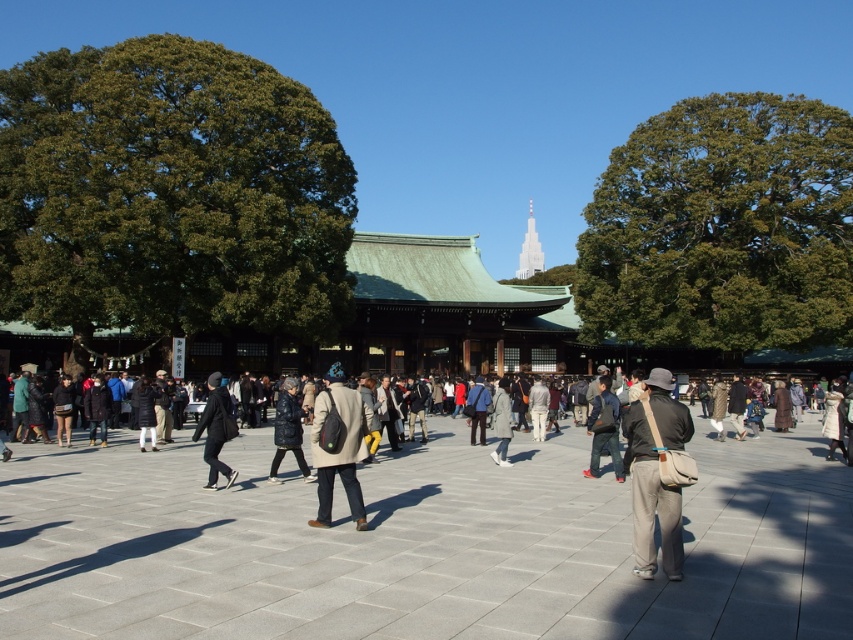
Does khaki canvas bag at center appear under dark gray fabric jacket at center?

Incorrect, khaki canvas bag at center is not positioned below dark gray fabric jacket at center.

Can you confirm if khaki canvas bag at center is bigger than dark gray fabric jacket at center?

No, khaki canvas bag at center is not bigger than dark gray fabric jacket at center.

Is point (650, 378) more distant than point (233, 424)?

No, (650, 378) is in front of (233, 424).

Locate an element on the screen. Image resolution: width=853 pixels, height=640 pixels. khaki canvas bag at center is located at coordinates (651, 500).

From the picture: Who is taller, matte black backpack at center or dark gray fabric jacket at center?

dark gray fabric jacket at center

Can you confirm if matte black backpack at center is bigger than dark gray fabric jacket at center?

No.

Locate an element on the screen. Image resolution: width=853 pixels, height=640 pixels. matte black backpack at center is located at coordinates (338, 445).

Is khaki canvas bag at center below matte black backpack at center?

Indeed, khaki canvas bag at center is positioned under matte black backpack at center.

Does point (654, 451) lie behind point (329, 422)?

No, (654, 451) is in front of (329, 422).

The height and width of the screenshot is (640, 853). I want to click on khaki canvas bag at center, so pos(651,500).